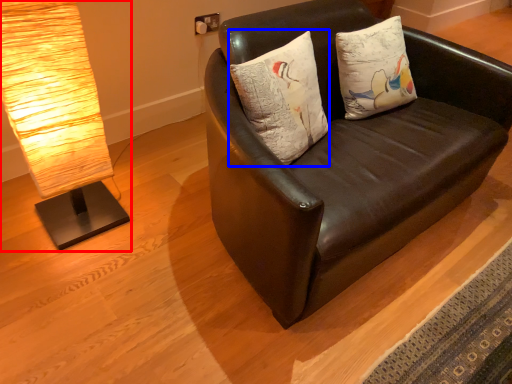
Question: Which object is further to the camera taking this photo, lamp (highlighted by a red box) or pillow (highlighted by a blue box)?

Choices:
 (A) lamp
 (B) pillow

Answer: (B)